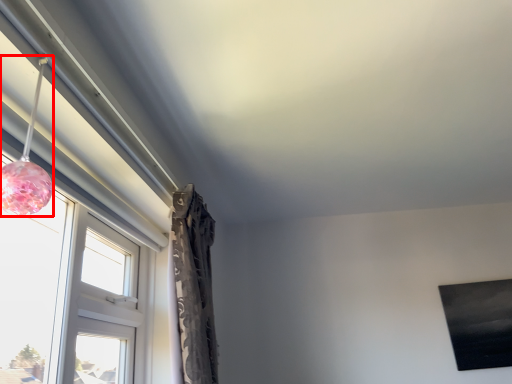
Question: From the image's perspective, where is lamp (annotated by the red box) located in relation to window in the image?

Choices:
 (A) below
 (B) above

Answer: (B)